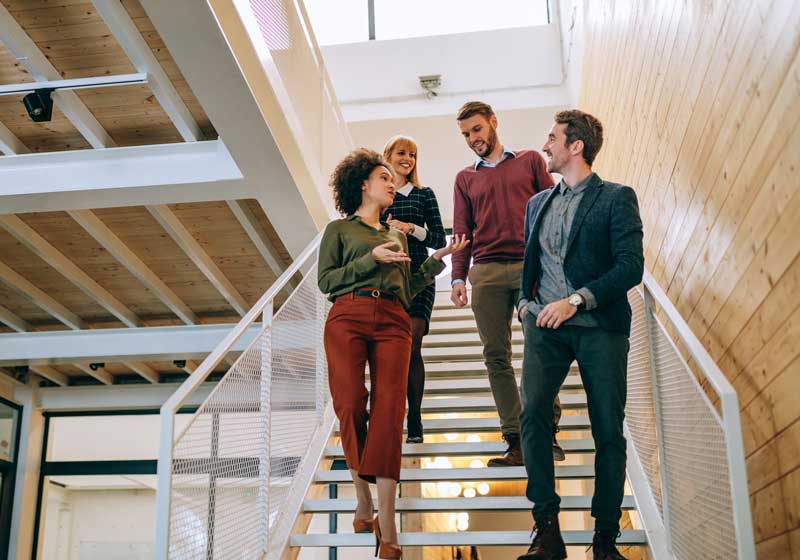
You are a GUI agent. You are given a task and a screenshot of the screen. Output one action in this format:
    pyautogui.click(x=<x>, y=<y>)
    Task: Click on the beams in ceiling
    The height and width of the screenshot is (560, 800).
    Given the screenshot: What is the action you would take?
    click(246, 217), click(200, 247), click(132, 270), click(90, 284), click(54, 298), click(8, 318)